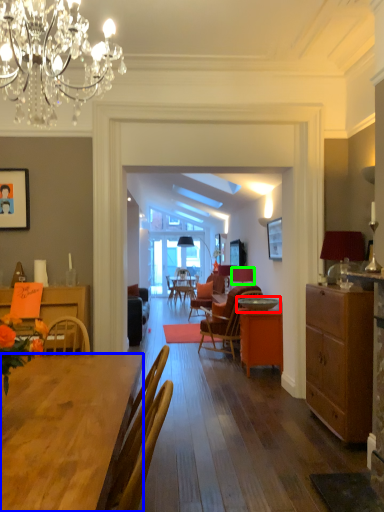
Question: Which object is the closest to the round table (highlighted by a red box)? Choose among these: desk (highlighted by a blue box) or lampshade (highlighted by a green box).

Choices:
 (A) desk
 (B) lampshade

Answer: (B)